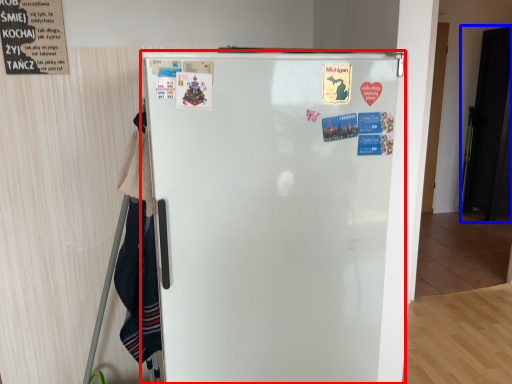
Question: Which point is further to the camera, refrigerator (highlighted by a red box) or door (highlighted by a blue box)?

Choices:
 (A) refrigerator
 (B) door

Answer: (B)